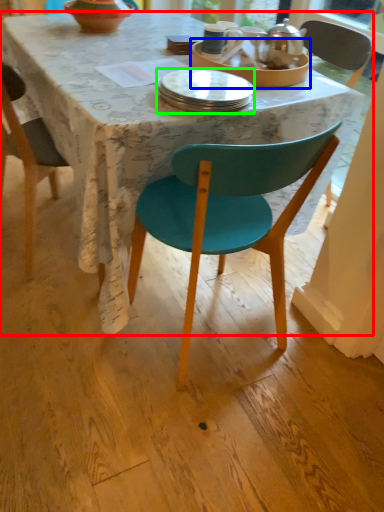
Question: Estimate the real-world distances between objects in this image. Which object is farther from desk (highlighted by a red box), tableware (highlighted by a blue box) or plate (highlighted by a green box)?

Choices:
 (A) tableware
 (B) plate

Answer: (A)